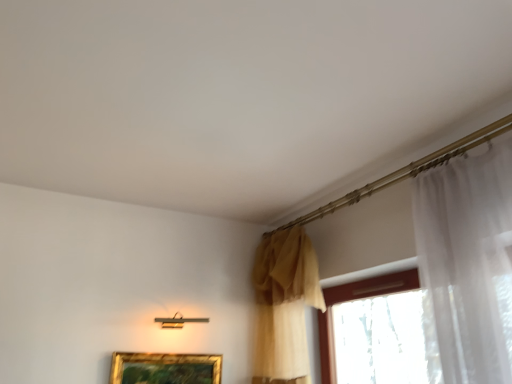
Locate an element on the screen. The height and width of the screenshot is (384, 512). matte yellow curtain at center is located at coordinates (284, 306).

Measure the distance between point (262, 296) and camera.

Point (262, 296) and camera are 8.53 feet apart.

What do you see at coordinates (284, 306) in the screenshot? The height and width of the screenshot is (384, 512). I see `matte yellow curtain at center` at bounding box center [284, 306].

At what (x,y) coordinates should I click in order to perform the action: click on gold metallic picture frame at lower center. Please return your answer as a coordinate pair (x, y). Image resolution: width=512 pixels, height=384 pixels. Looking at the image, I should click on (165, 368).

This screenshot has height=384, width=512. What do you see at coordinates (165, 368) in the screenshot?
I see `gold metallic picture frame at lower center` at bounding box center [165, 368].

This screenshot has width=512, height=384. What are the coordinates of `matte yellow curtain at center` in the screenshot? It's located at (284, 306).

Can you confirm if matte yellow curtain at center is positioned to the left of gold metallic picture frame at lower center?

In fact, matte yellow curtain at center is to the right of gold metallic picture frame at lower center.

Which is behind, matte yellow curtain at center or gold metallic picture frame at lower center?

Positioned behind is gold metallic picture frame at lower center.

Considering the points (269, 369) and (122, 380), which point is in front, point (269, 369) or point (122, 380)?

The point (122, 380) is in front.

From the image's perspective, between matte yellow curtain at center and gold metallic picture frame at lower center, which one is located above?

matte yellow curtain at center appears higher in the image.

From the picture: From a real-world perspective, who is located lower, matte yellow curtain at center or gold metallic picture frame at lower center?

gold metallic picture frame at lower center, from a real-world perspective.

Which object is wider, matte yellow curtain at center or gold metallic picture frame at lower center?

With larger width is matte yellow curtain at center.

Considering the relative sizes of matte yellow curtain at center and gold metallic picture frame at lower center in the image provided, is matte yellow curtain at center shorter than gold metallic picture frame at lower center?

In fact, matte yellow curtain at center may be taller than gold metallic picture frame at lower center.

Is matte yellow curtain at center bigger or smaller than gold metallic picture frame at lower center?

Considering their sizes, matte yellow curtain at center takes up more space than gold metallic picture frame at lower center.

Is matte yellow curtain at center situated inside gold metallic picture frame at lower center or outside?

matte yellow curtain at center is spatially situated outside gold metallic picture frame at lower center.

Consider the image. Is matte yellow curtain at center placed right next to gold metallic picture frame at lower center?

No, matte yellow curtain at center is not touching gold metallic picture frame at lower center.

Is matte yellow curtain at center facing away from gold metallic picture frame at lower center?

That's not correct — matte yellow curtain at center is not looking away from gold metallic picture frame at lower center.

Where is `curtain in front of the gold metallic picture frame at lower center`? This screenshot has width=512, height=384. curtain in front of the gold metallic picture frame at lower center is located at coordinates (284, 306).

Consider the image. Based on their positions, is gold metallic picture frame at lower center located to the left or right of matte yellow curtain at center?

In the image, gold metallic picture frame at lower center appears on the left side of matte yellow curtain at center.

Is the depth of gold metallic picture frame at lower center less than that of matte yellow curtain at center?

No, gold metallic picture frame at lower center is further to the viewer.

Which is in front, point (218, 370) or point (290, 320)?

Point (218, 370)

From the image's perspective, is gold metallic picture frame at lower center over matte yellow curtain at center?

Incorrect, from the image's perspective, gold metallic picture frame at lower center is lower than matte yellow curtain at center.

From a real-world perspective, is gold metallic picture frame at lower center on top of matte yellow curtain at center?

No, from a real-world perspective, gold metallic picture frame at lower center is not above matte yellow curtain at center.

From the picture: Considering the relative sizes of gold metallic picture frame at lower center and matte yellow curtain at center in the image provided, is gold metallic picture frame at lower center thinner than matte yellow curtain at center?

Indeed, gold metallic picture frame at lower center has a lesser width compared to matte yellow curtain at center.

Is gold metallic picture frame at lower center taller than matte yellow curtain at center?

No, gold metallic picture frame at lower center is not taller than matte yellow curtain at center.

Based on the photo, considering the sizes of objects gold metallic picture frame at lower center and matte yellow curtain at center in the image provided, who is bigger, gold metallic picture frame at lower center or matte yellow curtain at center?

matte yellow curtain at center.

From the picture: Is gold metallic picture frame at lower center located outside matte yellow curtain at center?

That's correct, gold metallic picture frame at lower center is outside of matte yellow curtain at center.

Is gold metallic picture frame at lower center directly adjacent to matte yellow curtain at center?

No, gold metallic picture frame at lower center is not next to matte yellow curtain at center.

Could you tell me if gold metallic picture frame at lower center is turned towards matte yellow curtain at center?

No, gold metallic picture frame at lower center is not oriented towards matte yellow curtain at center.

How different are the orientations of gold metallic picture frame at lower center and matte yellow curtain at center in degrees?

The angular difference between gold metallic picture frame at lower center and matte yellow curtain at center is 90.5 degrees.

At what (x,y) coordinates should I click in order to perform the action: click on curtain above the gold metallic picture frame at lower center (from a real-world perspective). Please return your answer as a coordinate pair (x, y). The image size is (512, 384). Looking at the image, I should click on (284, 306).

Locate an element on the screen. This screenshot has width=512, height=384. picture frame that appears behind the matte yellow curtain at center is located at coordinates (165, 368).

Find the location of a particular element. The height and width of the screenshot is (384, 512). picture frame below the matte yellow curtain at center (from a real-world perspective) is located at coordinates (165, 368).